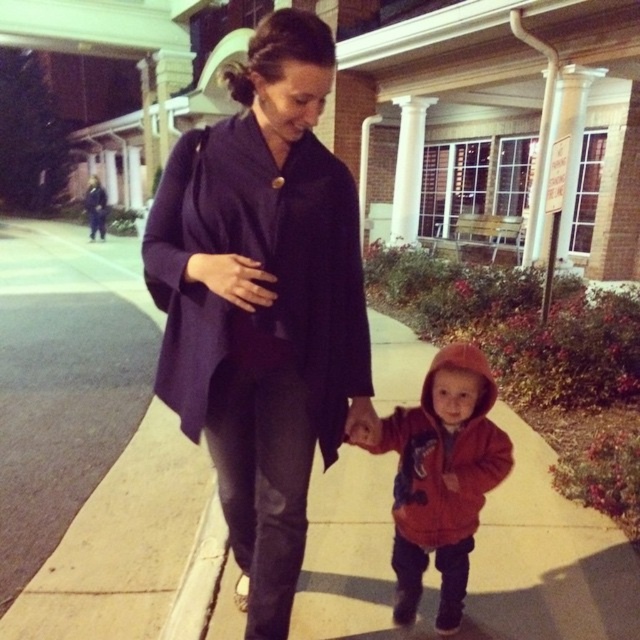
Between dark purple woolen coat at center and matte orange hoodie at center, which one has less height?

matte orange hoodie at center

Which of these two, dark purple woolen coat at center or matte orange hoodie at center, stands taller?

dark purple woolen coat at center

Locate an element on the screen. Image resolution: width=640 pixels, height=640 pixels. dark purple woolen coat at center is located at coordinates (262, 269).

The height and width of the screenshot is (640, 640). Identify the location of dark purple woolen coat at center. click(x=262, y=269).

Is matte orange hoodie at center positioned before concrete at lower left?

Yes, it is in front of concrete at lower left.

Does point (436, 477) lie in front of point (220, 509)?

That is True.

Which is in front, point (429, 541) or point (211, 586)?

Positioned in front is point (429, 541).

You are a GUI agent. You are given a task and a screenshot of the screen. Output one action in this format:
    pyautogui.click(x=<x>, y=<y>)
    Task: Click on the matte orange hoodie at center
    Image resolution: width=640 pixels, height=640 pixels.
    Given the screenshot: What is the action you would take?
    pyautogui.click(x=442, y=477)

Who is higher up, dark purple woolen coat at center or concrete at lower left?

dark purple woolen coat at center

The width and height of the screenshot is (640, 640). Describe the element at coordinates (262, 269) in the screenshot. I see `dark purple woolen coat at center` at that location.

Identify the location of dark purple woolen coat at center. (262, 269).